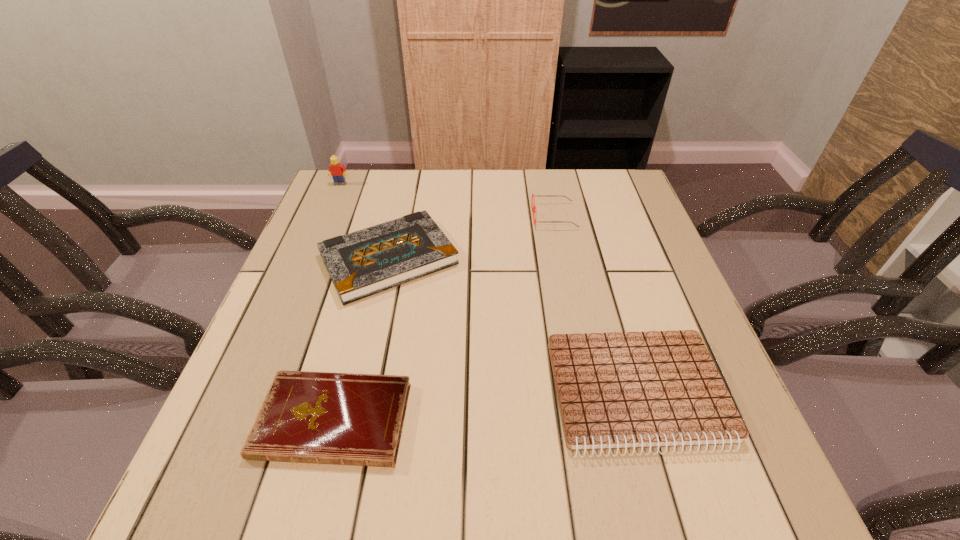
Find the location of a particular element. The height and width of the screenshot is (540, 960). the tallest object is located at coordinates (336, 170).

The image size is (960, 540). I want to click on the farthest object, so click(x=336, y=170).

Image resolution: width=960 pixels, height=540 pixels. In order to click on spectacles in this screenshot , I will do `click(533, 207)`.

I want to click on the tallest notebook, so 362,263.

Identify the location of the second shortest notebook. (619, 390).

Identify the location of the fourth tallest object. (619, 390).

Identify the location of the shortest object. (351, 419).

I want to click on free location located 0.090m on the front-facing side of the farthest object, so click(x=332, y=202).

Find the location of a particular element. This screenshot has width=960, height=540. vacant space situated on the front-facing side of the spectacles is located at coordinates (486, 216).

Identify the location of vacant space situated on the front-facing side of the spectacles. The width and height of the screenshot is (960, 540). (415, 216).